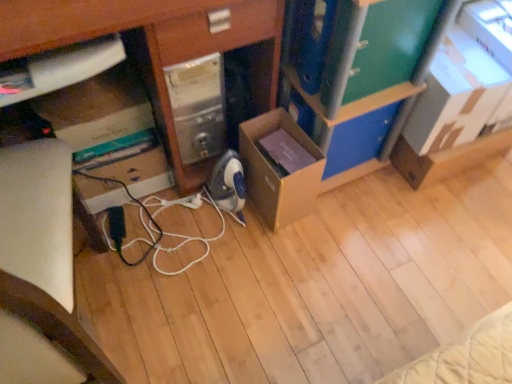
You are a GUI agent. You are given a task and a screenshot of the screen. Output one action in this format:
    pyautogui.click(x=<x>, y=<y>)
    Task: Click on the vacant region to the right of black rubber cable at center
    
    Given the screenshot: What is the action you would take?
    pyautogui.click(x=263, y=262)